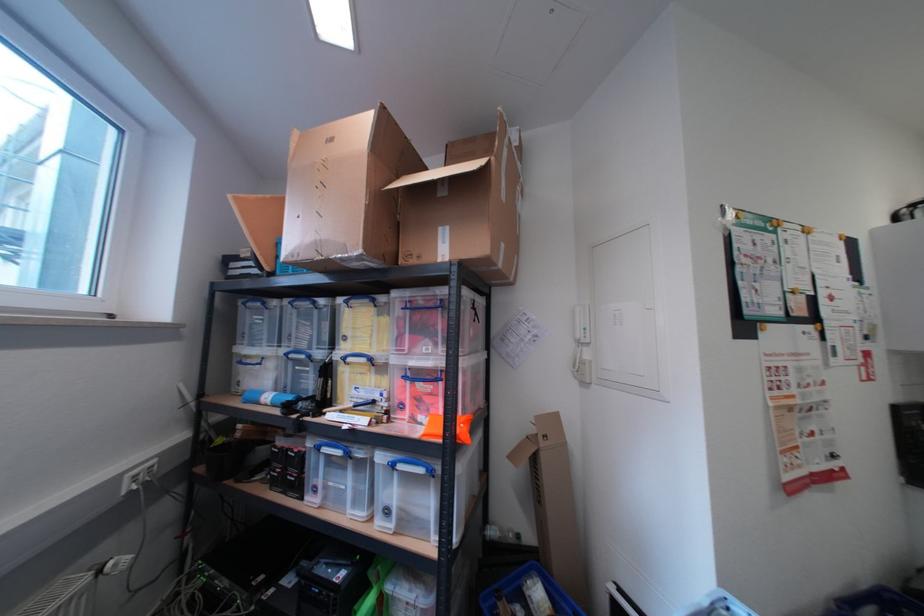
Identify the location of phone handset. Image resolution: width=924 pixels, height=616 pixels. (580, 323).